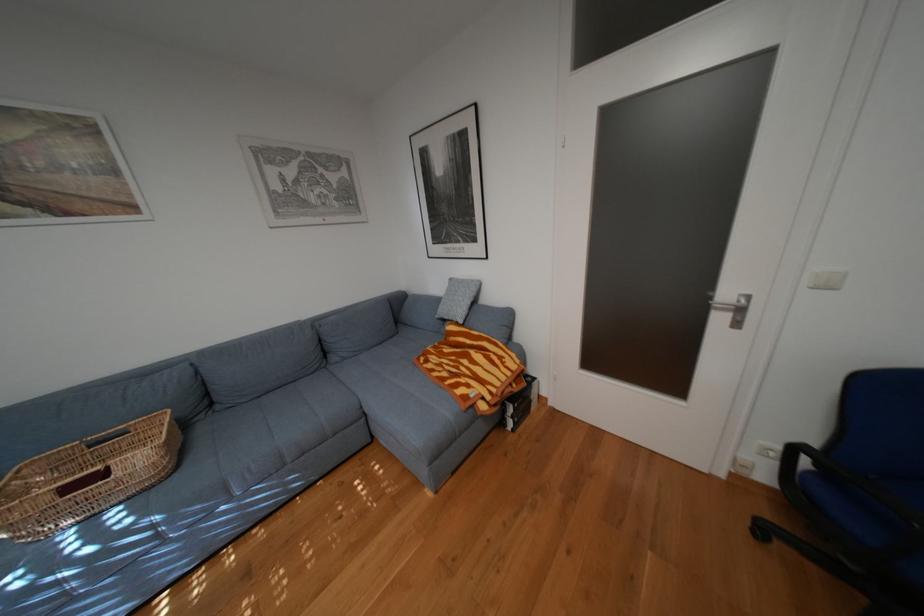
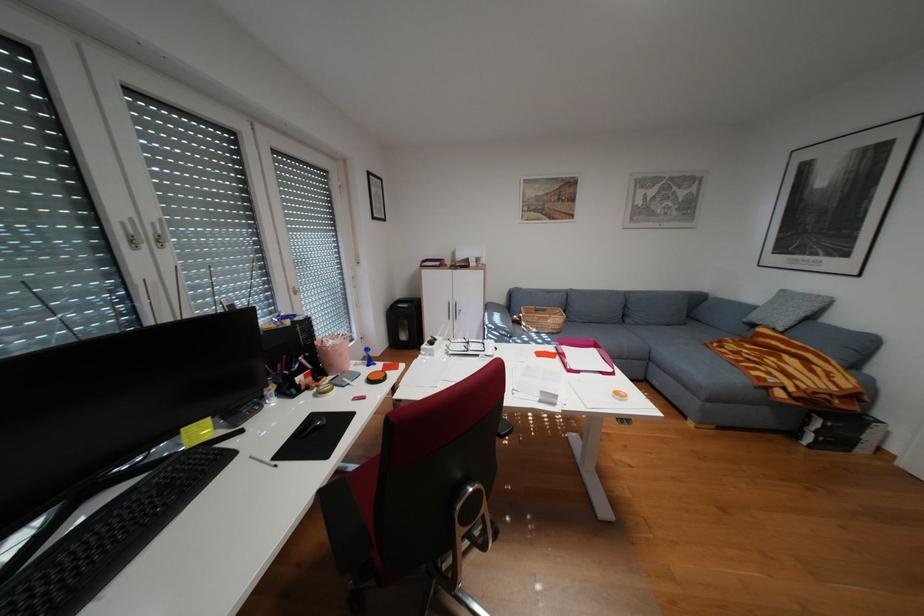
The point at (136, 432) is marked in the first image. Where is the corresponding point in the second image?

(556, 310)